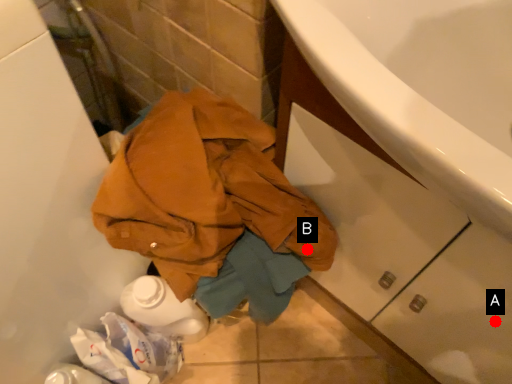
Question: Two points are circled on the image, labeled by A and B beside each circle. Which point appears farthest from the camera in this image?

Choices:
 (A) A is further
 (B) B is further

Answer: (B)